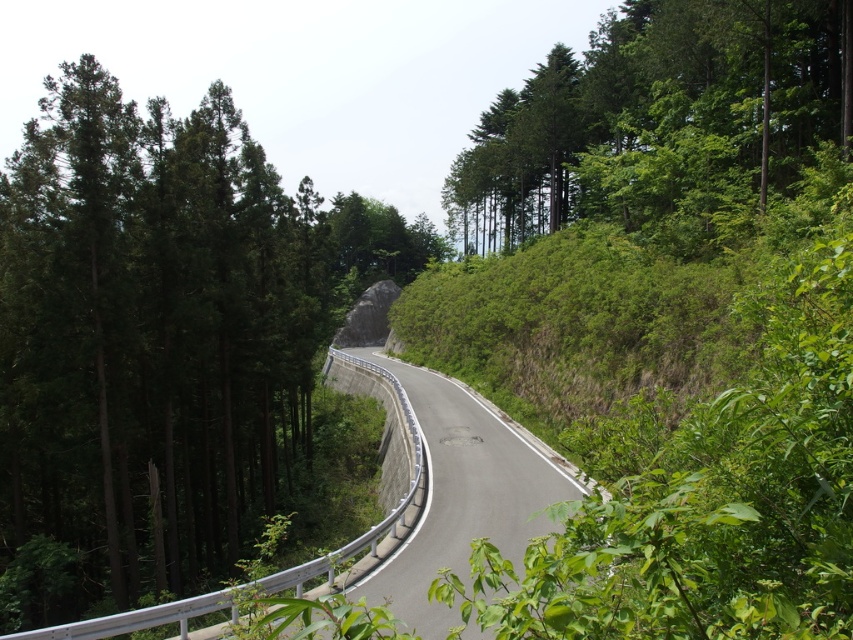
Question: Which object is positioned closest to the green leafy trees at upper right?

Choices:
 (A) green matte tree at left
 (B) asphalt road at center

Answer: (A)

Question: Which object is positioned farthest from the green leafy trees at upper right?

Choices:
 (A) green matte tree at left
 (B) asphalt road at center

Answer: (B)

Question: Does green leafy trees at upper right have a lesser width compared to asphalt road at center?

Choices:
 (A) yes
 (B) no

Answer: (B)

Question: Is green matte tree at left above green leafy trees at upper right?

Choices:
 (A) no
 (B) yes

Answer: (A)

Question: Which point is closer to the camera?

Choices:
 (A) (207, 115)
 (B) (608, 77)
 (C) (575, 483)

Answer: (C)

Question: Can you confirm if green leafy trees at upper right is thinner than asphalt road at center?

Choices:
 (A) yes
 (B) no

Answer: (B)